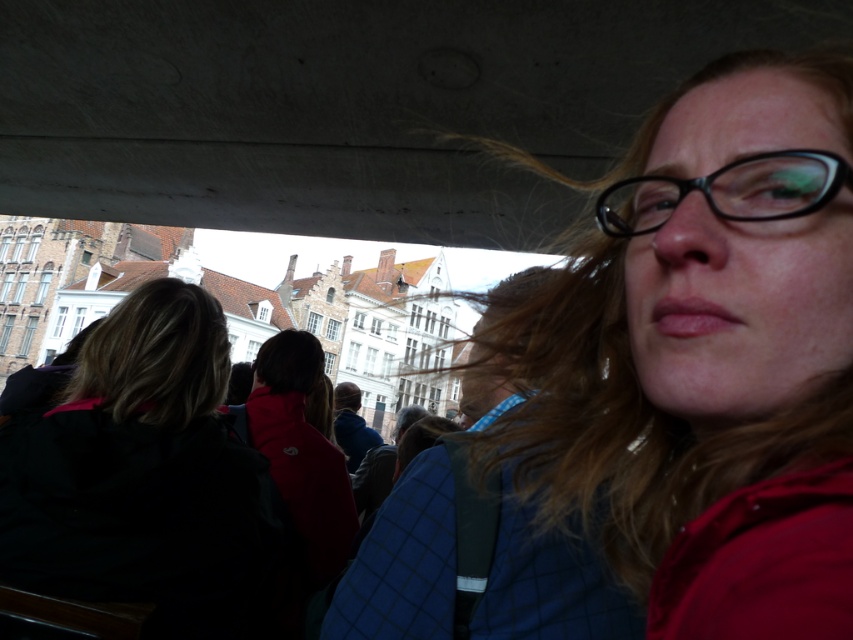
You are a photographer on a boat tour. You notice two pairs of glasses in the scene. The first is matte black glasses at upper right, and the second is black plastic glasses at upper right. Which pair of glasses is bigger?

The matte black glasses at upper right is larger compared to the black plastic glasses at upper right.

You are a photographer trying to capture a clear shot of the matte black glasses at upper right and the dark brown hair at center. Which object is located to the right of the other?

The matte black glasses at upper right is positioned on the right side of dark brown hair at center, so the matte black glasses at upper right is to the right of the dark brown hair at center.

You are a photographer trying to capture a clear shot of the person in the red jacket. The matte black glasses at upper right and the dark brown hair at center are both in the frame. Which object is positioned higher in the image?

The matte black glasses at upper right is above the dark brown hair at center, so the matte black glasses at upper right is positioned higher in the image.